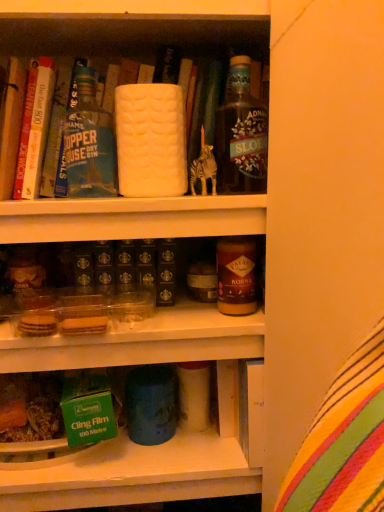
Question: Considering the positions of translucent glass bottle at upper right, positioned as the 2th bottle in left-to-right order, and hardcover book at upper left, which is counted as the 1th book, starting from the back, in the image, is translucent glass bottle at upper right, positioned as the 2th bottle in left-to-right order, wider or thinner than hardcover book at upper left, which is counted as the 1th book, starting from the back,?

Choices:
 (A) thin
 (B) wide

Answer: (A)

Question: From the image's perspective, is translucent glass bottle at upper right, positioned as the 2th bottle in left-to-right order, positioned above or below hardcover book at upper left, which is counted as the 1th book, starting from the back?

Choices:
 (A) below
 (B) above

Answer: (A)

Question: Estimate the real-world distances between objects in this image. Which object is closer to the hardcover book at upper left, the 1th book positioned from the front?

Choices:
 (A) green matte cling film at lower left
 (B) brown glass jar at center
 (C) white matte bottle at upper center, positioned as the second bottle in right-to-left order
 (D) translucent glass bottle at upper right, the 1th bottle from the right
 (E) hardcover book at upper left, which ranks as the second book in front-to-back order

Answer: (E)

Question: Which object is the closest to the translucent glass bottle at upper right, positioned as the 2th bottle in left-to-right order?

Choices:
 (A) hardcover book at upper left, the 1th book positioned from the front
 (B) white matte bottle at upper center, which is counted as the first bottle, starting from the left
 (C) brown glass jar at center
 (D) hardcover book at upper left, which is counted as the 1th book, starting from the back
 (E) green matte cling film at lower left

Answer: (C)